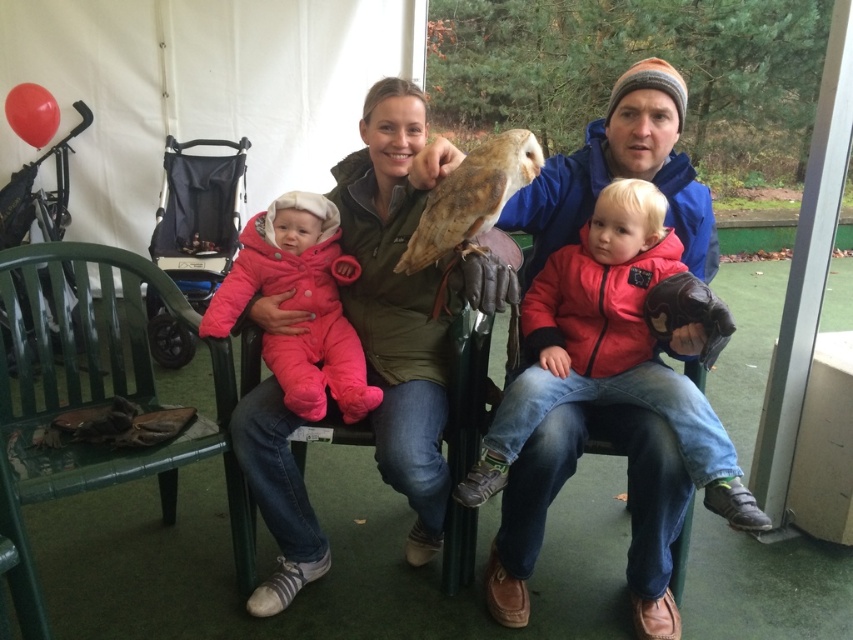
Based on the photo, which is above, matte green jacket at center or green plastic chair at left?

Positioned higher is matte green jacket at center.

Is matte green jacket at center smaller than green plastic chair at left?

Indeed, matte green jacket at center has a smaller size compared to green plastic chair at left.

Is point (250, 476) in front of point (248, 541)?

Yes, point (250, 476) is closer to viewer.

This screenshot has height=640, width=853. What are the coordinates of `matte green jacket at center` in the screenshot? It's located at (396, 305).

Can you confirm if blue fleece jacket at center is bigger than green plastic chair at left?

Correct, blue fleece jacket at center is larger in size than green plastic chair at left.

Is the position of blue fleece jacket at center less distant than that of green plastic chair at left?

Yes, it is in front of green plastic chair at left.

Does point (660, 563) come closer to viewer compared to point (140, 368)?

Yes, it is in front of point (140, 368).

The width and height of the screenshot is (853, 640). I want to click on blue fleece jacket at center, so click(x=627, y=506).

Does matte green jacket at center appear on the left side of blue fleece jacket at center?

Indeed, matte green jacket at center is positioned on the left side of blue fleece jacket at center.

In the scene shown: Who is positioned more to the right, matte green jacket at center or blue fleece jacket at center?

Positioned to the right is blue fleece jacket at center.

What do you see at coordinates (396, 305) in the screenshot?
I see `matte green jacket at center` at bounding box center [396, 305].

This screenshot has width=853, height=640. Identify the location of matte green jacket at center. (396, 305).